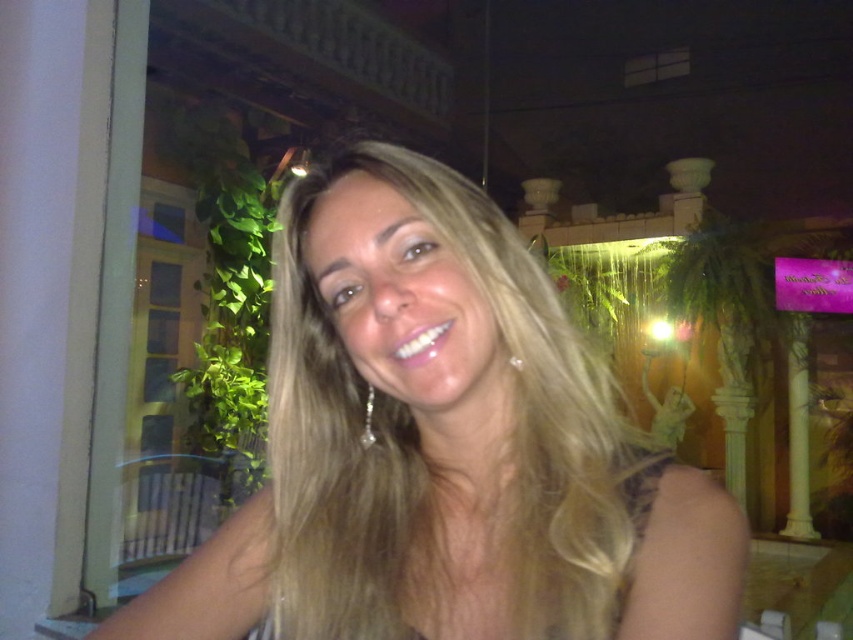
Is blonde hair at center thinner than silky blonde hair at center?

Incorrect, blonde hair at center's width is not less than silky blonde hair at center's.

Who is more distant from viewer, [291,620] or [367,618]?

The point [291,620] is more distant.

What are the coordinates of `blonde hair at center` in the screenshot? It's located at (442, 448).

The image size is (853, 640). I want to click on blonde hair at center, so click(x=442, y=448).